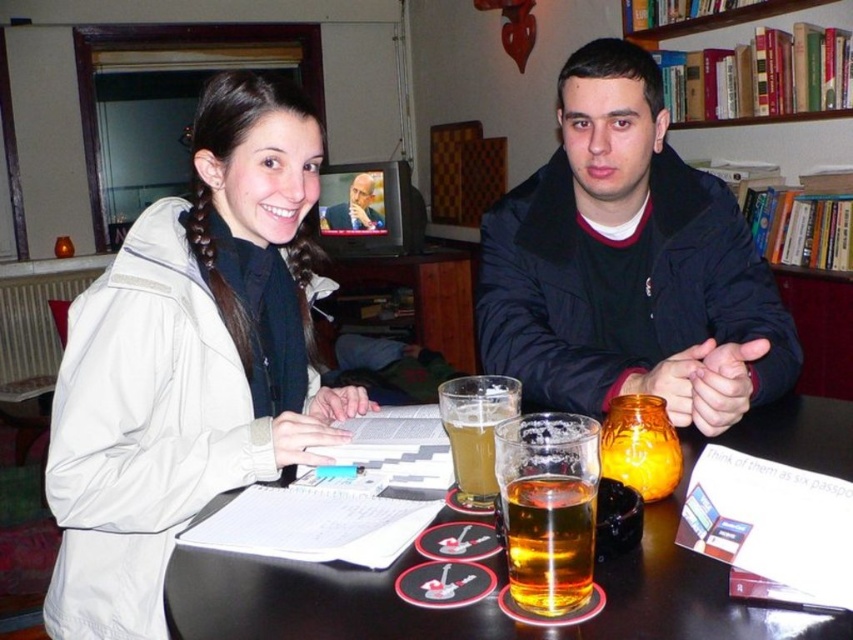
Between point (126, 512) and point (354, 186), which one is positioned behind?

The point (354, 186) is behind.

The width and height of the screenshot is (853, 640). Describe the element at coordinates (189, 362) in the screenshot. I see `white matte jacket at upper left` at that location.

The image size is (853, 640). I want to click on white matte jacket at upper left, so click(x=189, y=362).

Can you confirm if wooden bookshelf at upper center is positioned to the right of smooth skin face at center?

Indeed, wooden bookshelf at upper center is positioned on the right side of smooth skin face at center.

Is point (758, 157) positioned behind point (374, 211)?

No, it is in front of (374, 211).

In order to click on wooden bookshelf at upper center in this screenshot , I will do `click(770, 140)`.

The width and height of the screenshot is (853, 640). I want to click on white matte jacket at upper left, so click(189, 362).

Does white matte jacket at upper left appear over translucent amber liquid at table center?

Yes.

Is point (265, 317) positioned after point (572, 486)?

Yes, it is behind point (572, 486).

Locate an element on the screen. This screenshot has height=640, width=853. white matte jacket at upper left is located at coordinates (189, 362).